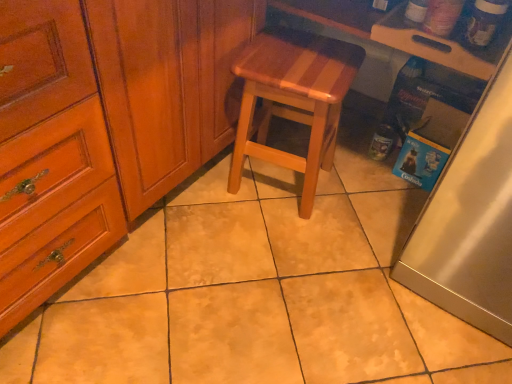
Identify the location of vacant area that lies in front of natural wood stool at center. This screenshot has height=384, width=512. (274, 243).